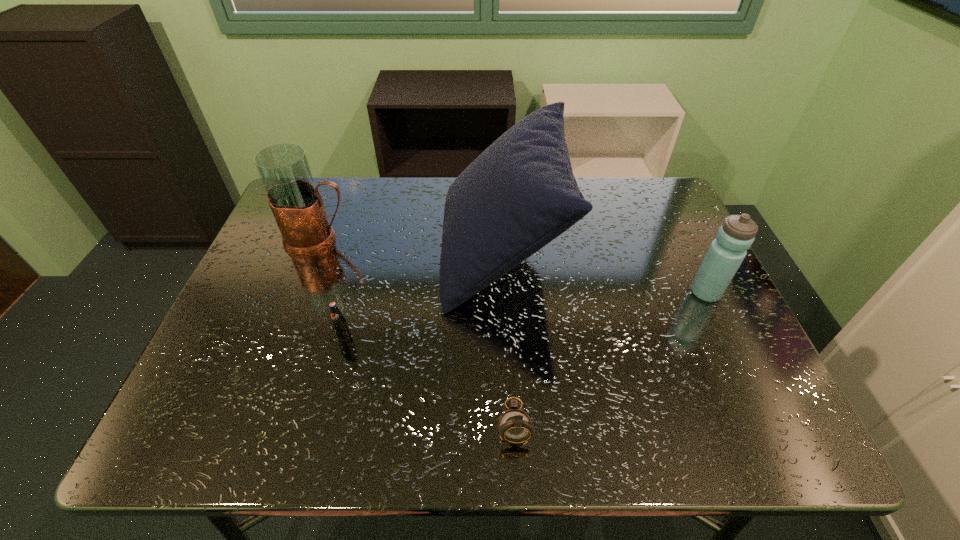
This screenshot has width=960, height=540. In order to click on free space located 0.070m with the handle on the side of the pitcher in this screenshot , I will do `click(378, 240)`.

Identify the location of free region located on the front of the rightmost object. This screenshot has width=960, height=540. 721,325.

You are a GUI agent. You are given a task and a screenshot of the screen. Output one action in this format:
    pyautogui.click(x=<x>, y=<y>)
    Task: Click on the vacant space located 0.230m on the front label of the second nearest object
    The image size is (960, 540).
    Given the screenshot: What is the action you would take?
    pyautogui.click(x=315, y=450)

Where is `cushion present at the far edge`? This screenshot has height=540, width=960. cushion present at the far edge is located at coordinates (518, 195).

The width and height of the screenshot is (960, 540). In order to click on pitcher located in the far edge section of the desktop in this screenshot , I will do `click(296, 203)`.

Locate an element on the screen. object that is at the near edge is located at coordinates (515, 426).

The height and width of the screenshot is (540, 960). Find the location of `object located at the left edge`. object located at the left edge is located at coordinates (296, 203).

The height and width of the screenshot is (540, 960). What are the coordinates of `object that is at the right edge` in the screenshot? It's located at (735, 236).

The image size is (960, 540). Find the location of `object that is at the far left corner`. object that is at the far left corner is located at coordinates (296, 203).

Locate an element on the screen. The width and height of the screenshot is (960, 540). blank space at the far edge of the desktop is located at coordinates (414, 213).